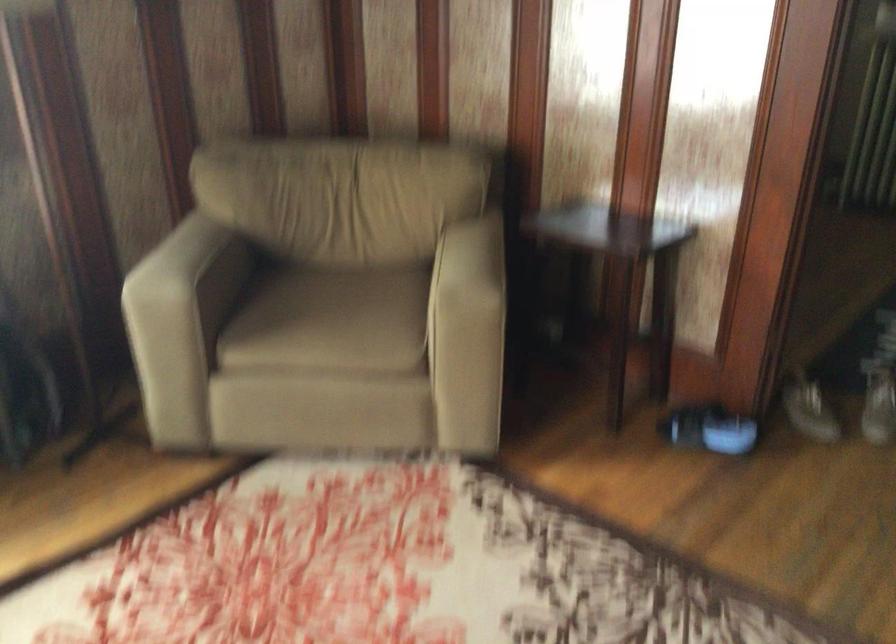
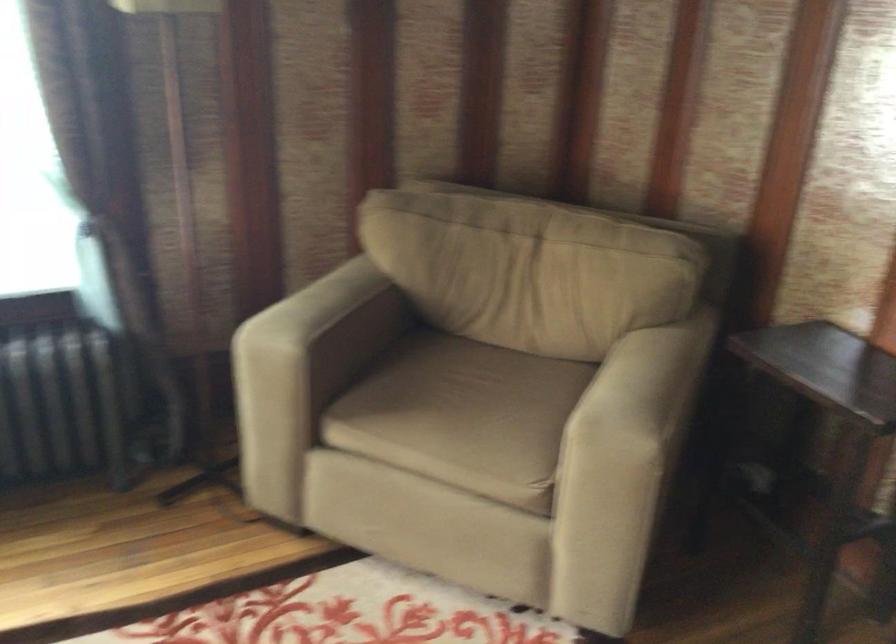
Find the pixel in the second image that matches point 597,228 in the first image.

(826, 368)